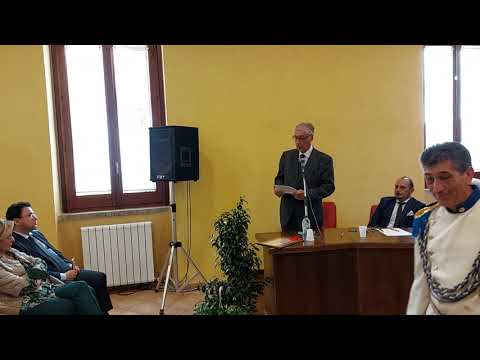
You are a GUI agent. You are given a task and a screenshot of the screen. Output one action in this format:
    pyautogui.click(x=<x>, y=<y>)
    Task: Click on the window
    The image size is (480, 360).
    Given the screenshot: What is the action you would take?
    pyautogui.click(x=133, y=113), pyautogui.click(x=89, y=120), pyautogui.click(x=434, y=102), pyautogui.click(x=472, y=101)